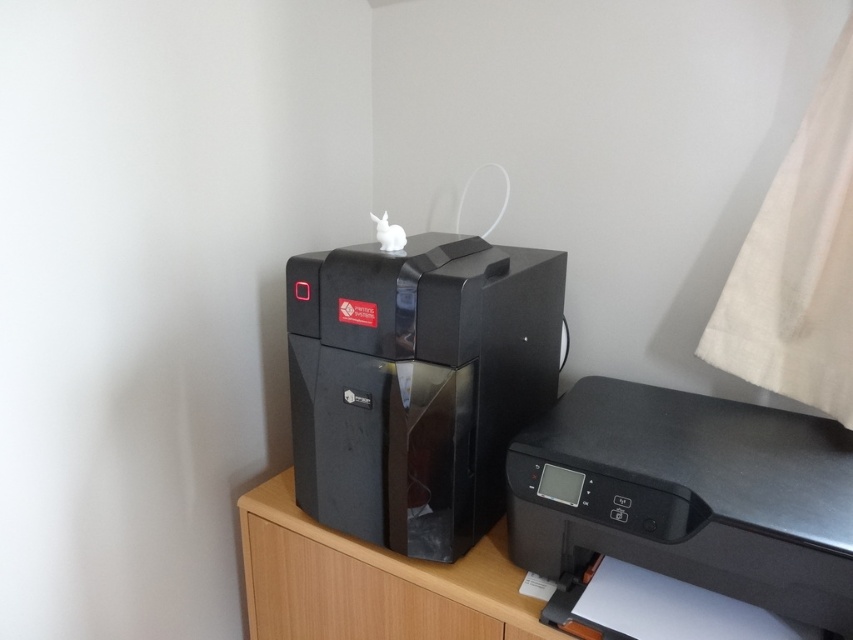
Between black glossy printer at center and black plastic printer at lower right, which one appears on the left side from the viewer's perspective?

black glossy printer at center is more to the left.

Looking at this image, between black glossy printer at center and black plastic printer at lower right, which one appears on the right side from the viewer's perspective?

black plastic printer at lower right is more to the right.

Measure the distance between black glossy printer at center and camera.

black glossy printer at center and camera are 34.10 inches apart.

Where is `black glossy printer at center`? black glossy printer at center is located at coordinates (416, 384).

Is point (805, 522) positioned behind point (372, 570)?

No, (805, 522) is in front of (372, 570).

This screenshot has height=640, width=853. Find the location of `black plastic printer at lower right`. black plastic printer at lower right is located at coordinates (688, 496).

Is point (346, 390) less distant than point (393, 577)?

Yes, point (346, 390) is closer to viewer.

Identify the location of black glossy printer at center. This screenshot has height=640, width=853. (416, 384).